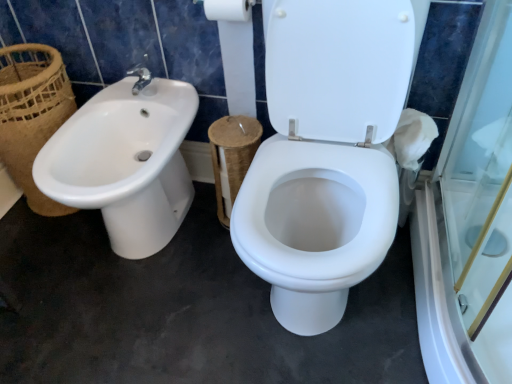
Question: Is white cardboard toilet paper at upper center thinner than brown woven basket at left?

Choices:
 (A) yes
 (B) no

Answer: (A)

Question: From the image's perspective, is white cardboard toilet paper at upper center under brown woven basket at left?

Choices:
 (A) yes
 (B) no

Answer: (B)

Question: Is white cardboard toilet paper at upper center in front of brown woven basket at left?

Choices:
 (A) yes
 (B) no

Answer: (A)

Question: From a real-world perspective, is white cardboard toilet paper at upper center positioned under brown woven basket at left based on gravity?

Choices:
 (A) yes
 (B) no

Answer: (B)

Question: Would you say white cardboard toilet paper at upper center is outside brown woven basket at left?

Choices:
 (A) no
 (B) yes

Answer: (B)

Question: Is there a large distance between white cardboard toilet paper at upper center and brown woven basket at left?

Choices:
 (A) no
 (B) yes

Answer: (A)

Question: Can you see white glossy sink at left touching brown woven basket at left?

Choices:
 (A) no
 (B) yes

Answer: (A)

Question: Can we say white glossy sink at left lies outside brown woven basket at left?

Choices:
 (A) yes
 (B) no

Answer: (A)

Question: Does white glossy sink at left have a lesser height compared to brown woven basket at left?

Choices:
 (A) yes
 (B) no

Answer: (A)

Question: Is white glossy sink at left taller than brown woven basket at left?

Choices:
 (A) yes
 (B) no

Answer: (B)

Question: Is white glossy sink at left in front of brown woven basket at left?

Choices:
 (A) no
 (B) yes

Answer: (B)

Question: Is white glossy sink at left to the right of brown woven basket at left from the viewer's perspective?

Choices:
 (A) yes
 (B) no

Answer: (A)

Question: Is brown woven basket at left positioned behind white glossy sink at left?

Choices:
 (A) yes
 (B) no

Answer: (A)